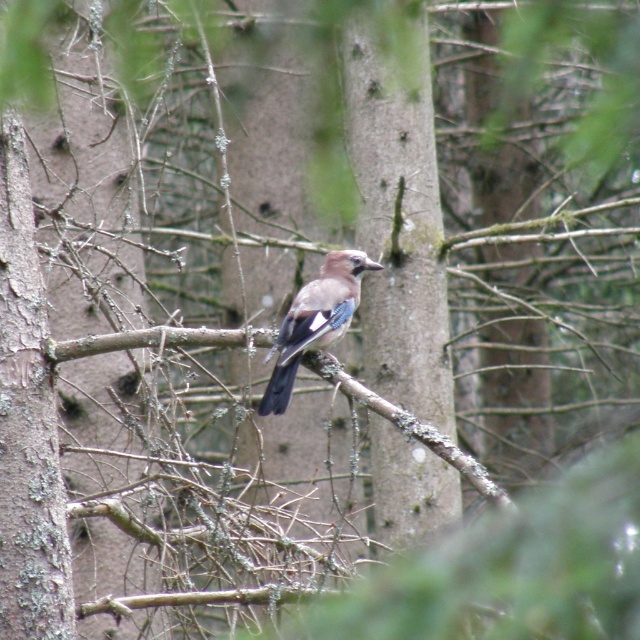
Based on the photo, measure the distance between point [420,192] and camera.

Point [420,192] and camera are 4.43 meters apart from each other.

Who is more distant from viewer, (384, 145) or (358, 272)?

Point (384, 145)

What do you see at coordinates (397, 212) in the screenshot? The width and height of the screenshot is (640, 640). I see `brown rough tree trunk at center` at bounding box center [397, 212].

You are a GUI agent. You are given a task and a screenshot of the screen. Output one action in this format:
    pyautogui.click(x=<x>, y=<y>)
    Task: Click on the brown rough tree trunk at center
    
    Given the screenshot: What is the action you would take?
    pyautogui.click(x=397, y=212)